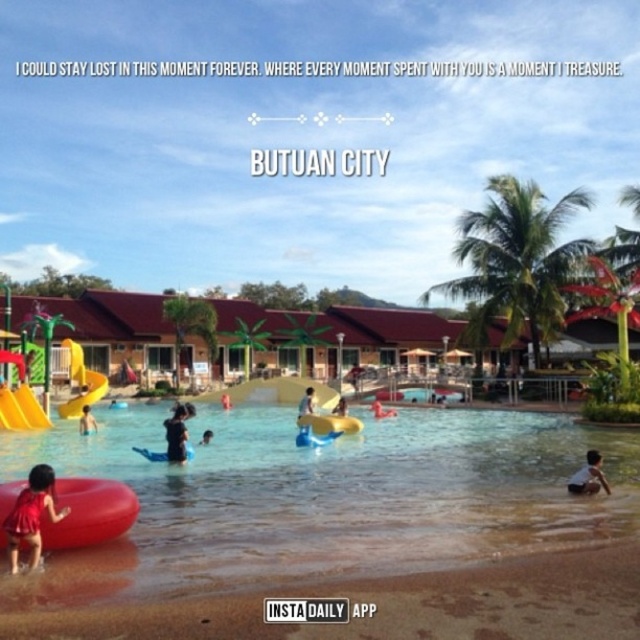
Which is behind, point (17, 387) or point (378, 417)?

The point (17, 387) is behind.

In the scene shown: Between yellow plastic slide at lower left and matte yellow float at center, which one is positioned lower?

matte yellow float at center is lower down.

Who is more distant from viewer, (x=20, y=364) or (x=390, y=410)?

The point (x=390, y=410) is behind.

This screenshot has width=640, height=640. Identify the location of yellow plastic slide at lower left. (19, 400).

Can you confirm if matte black swimsuit at center is wider than matte yellow float at center?

Correct, the width of matte black swimsuit at center exceeds that of matte yellow float at center.

Does point (92, 429) come closer to viewer compared to point (372, 416)?

Yes, point (92, 429) is closer to viewer.

The image size is (640, 640). In order to click on matte black swimsuit at center in this screenshot , I will do `click(86, 420)`.

Between clear water at center and matte black swimsuit at center, which one has more height?

clear water at center

Does clear water at center appear under matte black swimsuit at center?

Yes, clear water at center is below matte black swimsuit at center.

Locate an element on the screen. This screenshot has width=640, height=640. clear water at center is located at coordinates (324, 497).